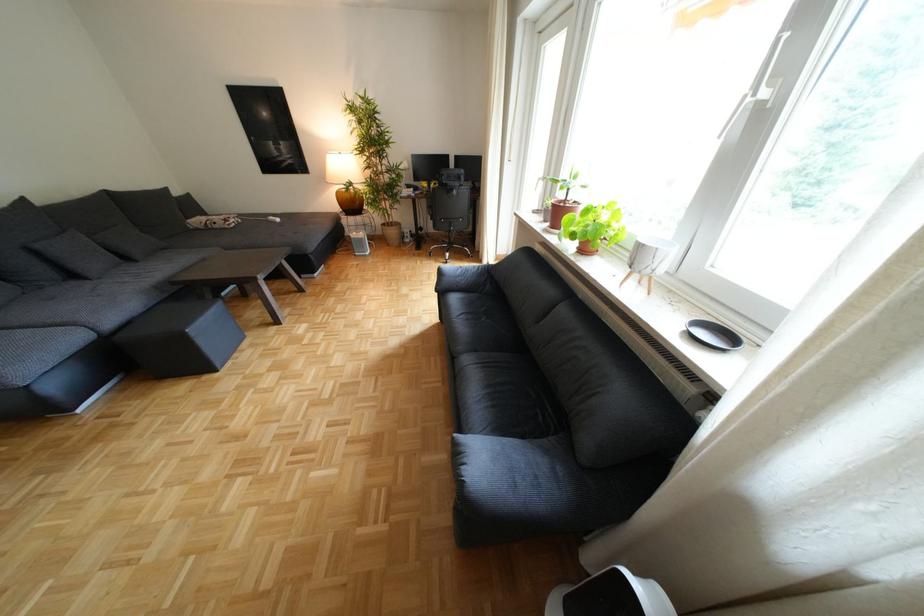
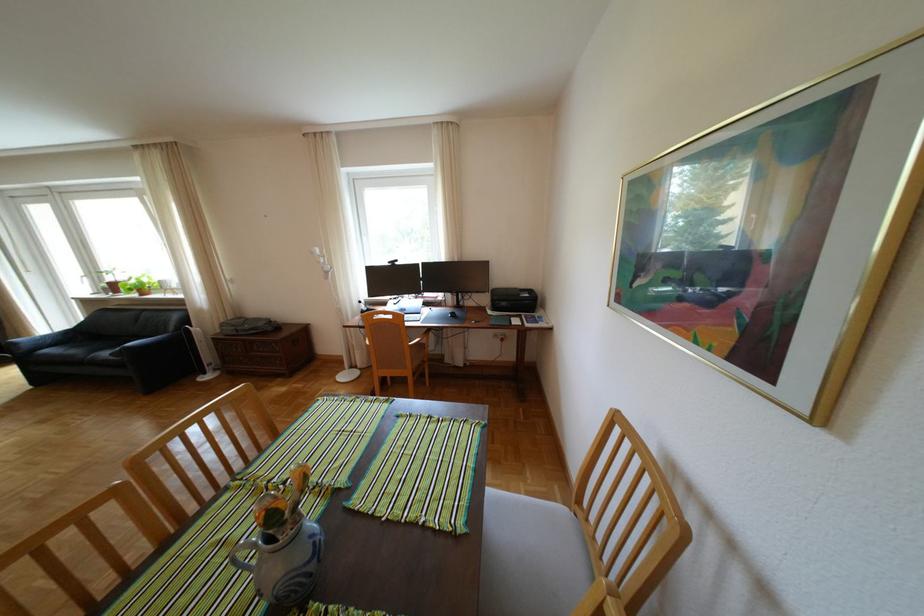
The point at (612, 228) is marked in the first image. Where is the corresponding point in the second image?

(154, 283)